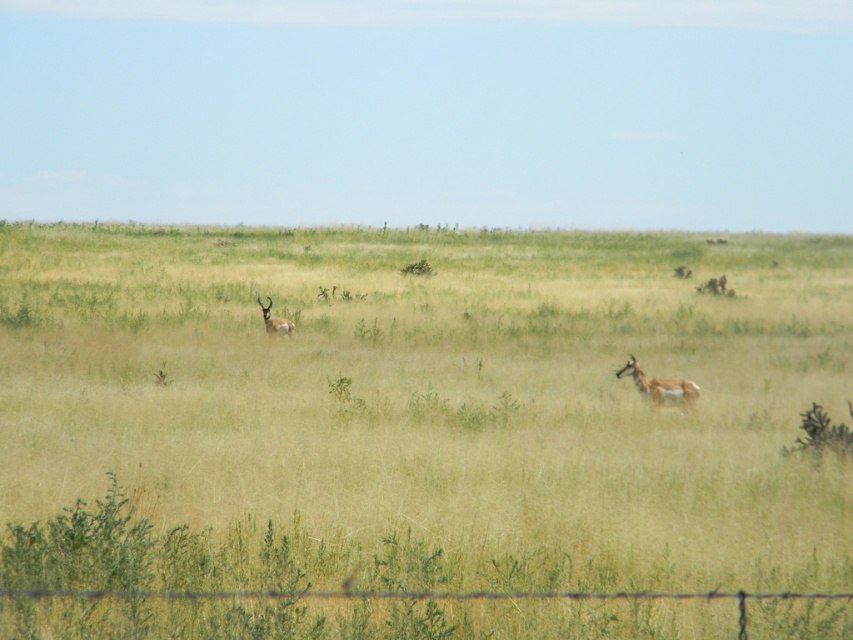
Between point (642, 381) and point (276, 330), which one is positioned in front?

Point (642, 381) is in front.

In order to click on spotted fur antelope at center in this screenshot , I will do `click(660, 387)`.

Is point (631, 369) behind point (270, 300)?

No, (631, 369) is in front of (270, 300).

Where is `spotted fur antelope at center`? The image size is (853, 640). spotted fur antelope at center is located at coordinates (660, 387).

Measure the distance between point [67,589] and camera.

The distance of point [67,589] from camera is 25.69 feet.

Between barbed wire at lower center and spotted fur antelope at center, which one appears on the left side from the viewer's perspective?

barbed wire at lower center

Is point (97, 592) positioned in front of point (682, 394)?

Yes, point (97, 592) is in front of point (682, 394).

You are a GUI agent. You are given a task and a screenshot of the screen. Output one action in this format:
    pyautogui.click(x=<x>, y=<y>)
    Task: Click on the barbed wire at lower center
    This screenshot has width=853, height=640.
    Given the screenshot: What is the action you would take?
    pyautogui.click(x=418, y=595)

Does point (616, 595) come behind point (283, 317)?

No, it is in front of (283, 317).

Can you confirm if barbed wire at lower center is positioned to the right of brown fur antelope at left?

Correct, you'll find barbed wire at lower center to the right of brown fur antelope at left.

Find the location of `barbed wire at lower center`. barbed wire at lower center is located at coordinates (418, 595).

This screenshot has width=853, height=640. Identify the location of barbed wire at lower center. (418, 595).